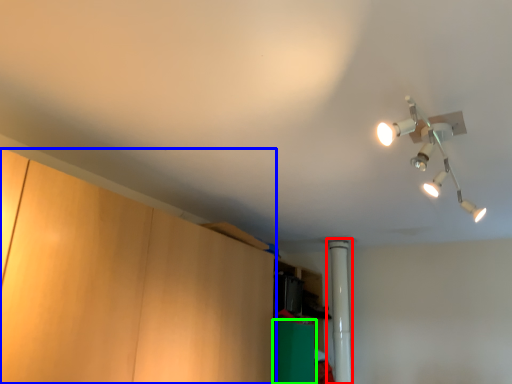
Question: Estimate the real-world distances between objects in this image. Which object is closer to pipe (highlighted by a red box), cabinetry (highlighted by a blue box) or cabinetry (highlighted by a green box)?

Choices:
 (A) cabinetry
 (B) cabinetry

Answer: (B)